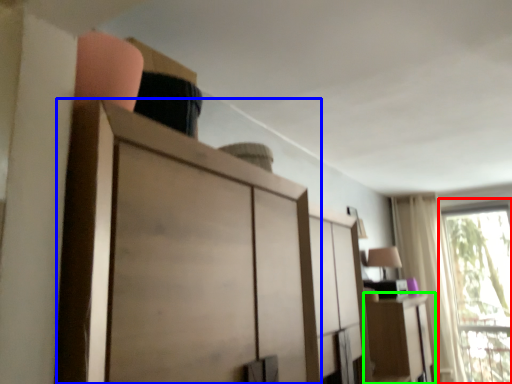
Question: Which is nearer to the window (highlighted by a red box)? cupboard (highlighted by a blue box) or cabinetry (highlighted by a green box).

Choices:
 (A) cupboard
 (B) cabinetry

Answer: (B)